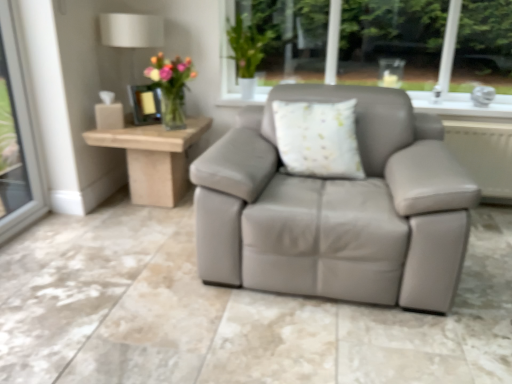
Identify the location of vacant area that is in front of light wood/roughobject at left. (111, 240).